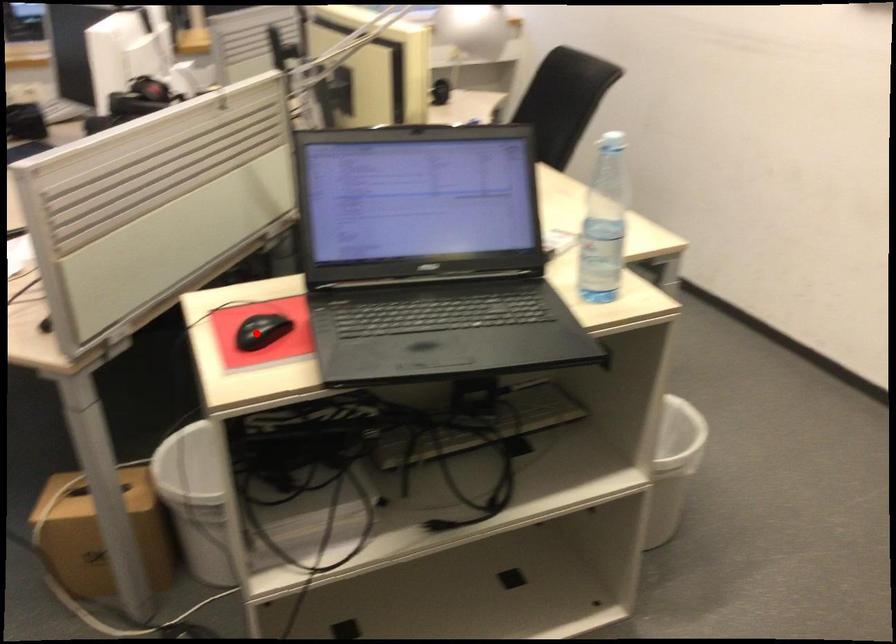
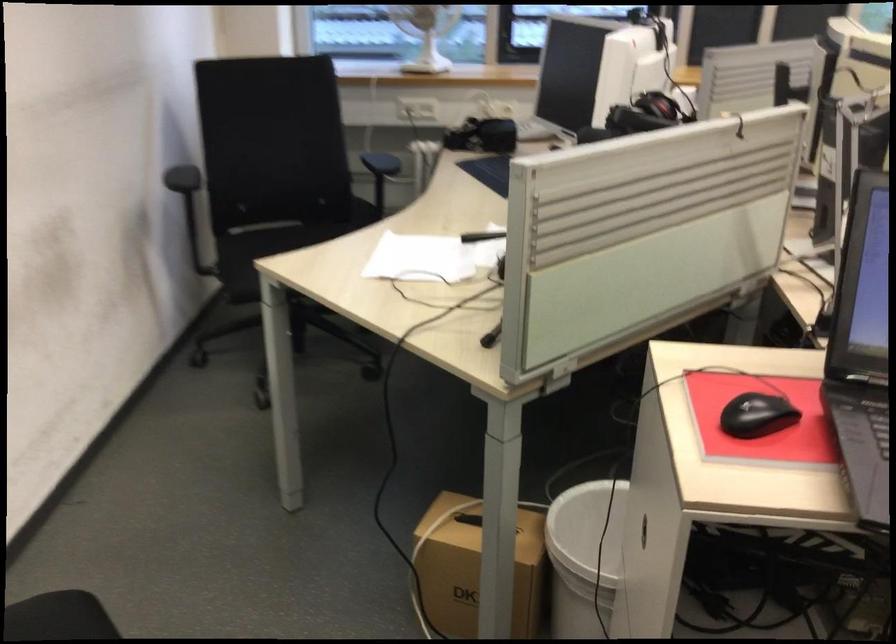
Question: I am providing you with two images of the same scene from different viewpoints. A red point is shown in image1. For the corresponding object point in image2, is it positioned nearer or farther from the camera?

Choices:
 (A) Nearer
 (B) Farther

Answer: (A)